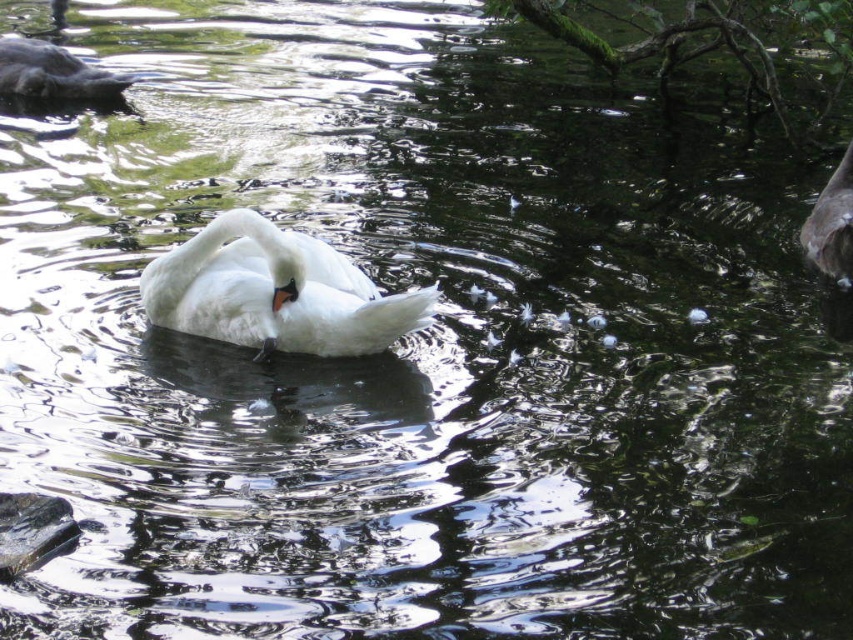
You are observing a swan in a pond and notice a dark gray duck at upper left and dark gray feathers at upper right. Which object is bigger?

The dark gray duck at upper left is larger in size than dark gray feathers at upper right.

You are standing at the edge of the water and see the white feathered swan at center. If you want to approach it without disturbing the water, which direction should you move relative to the swan?

Since the white feathered swan at center is located at coordinates approximately 0.456 on the x axis and 0.322 on the y axis, you should move towards the swan from the direction opposite to its current position to avoid creating ripples that might disturb it. However, without knowing your exact starting position, it is difficult to give a precise direction. A safer approach would be to remain still or move slowly and quietly around the area away from the water surface.

You are a photographer standing at the edge of the pond, and you want to capture the dark gray duck at upper left in your shot. Where should you aim your camera to include it in the frame?

You should aim your camera towards the upper left corner of the frame, specifically at the coordinates point (51, 74), to capture the dark gray duck at upper left in your shot.